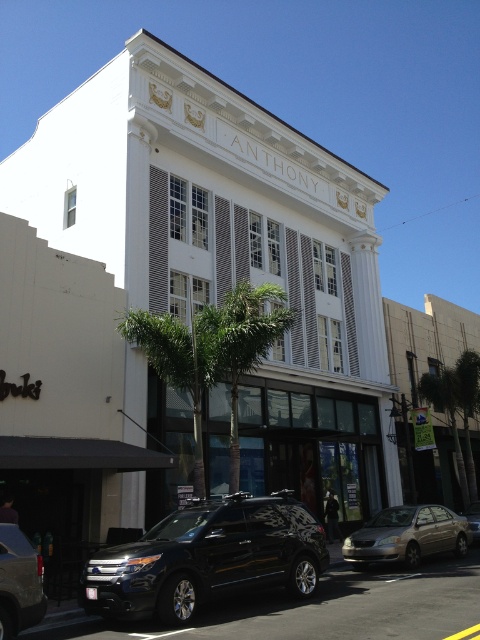
Looking at this image, you are a delivery driver who needs to park your van near the white building with gold letters. You see a silver metallic sedan at lower center and a metallic silver suv at lower left. Which vehicle is blocking the parking spot directly in front of the building?

The metallic silver suv at lower left is blocking the parking spot directly in front of the building because the silver metallic sedan at lower center is positioned under it, indicating the SUV is closer to the building.

You are standing at the point marked by the coordinate point (207, 557) in the image. Which object are you currently positioned on?

You are positioned on the glossy black SUV at lower left, as the point (207, 557) is located on that object.

You are standing at the camera position in the image. There is a silver metallic sedan at lower center. Can you safely walk to the sedan without crossing the street?

The silver metallic sedan at lower center is 52.09 feet away from the camera. Since the sedan is at lower center, it is likely positioned on the same side of the street as the camera, so you can safely walk to it without crossing the street.